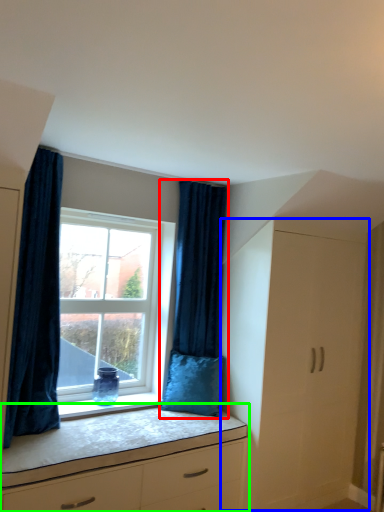
Question: Which object is the farthest from curtain (highlighted by a red box)? Choose among these: file cabinet (highlighted by a blue box) or chest of drawers (highlighted by a green box).

Choices:
 (A) file cabinet
 (B) chest of drawers

Answer: (B)